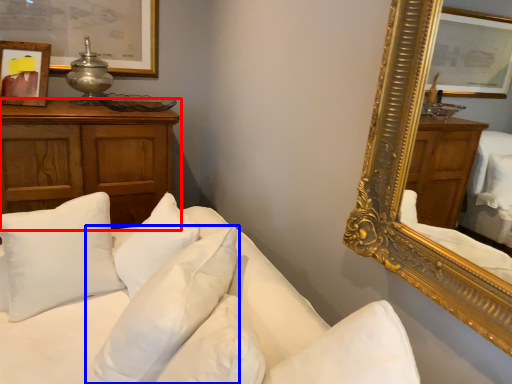
Question: Which point is further to the camera, cabinetry (highlighted by a red box) or pillow (highlighted by a blue box)?

Choices:
 (A) cabinetry
 (B) pillow

Answer: (A)